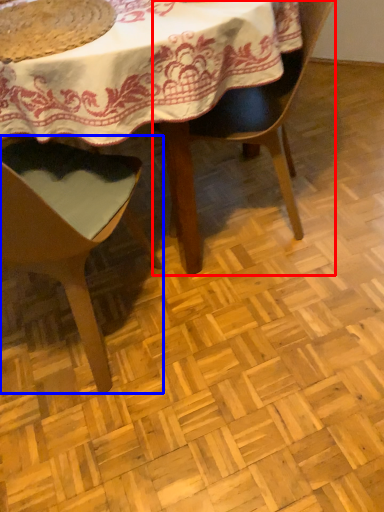
Question: Which object is further to the camera taking this photo, chair (highlighted by a red box) or chair (highlighted by a blue box)?

Choices:
 (A) chair
 (B) chair

Answer: (A)